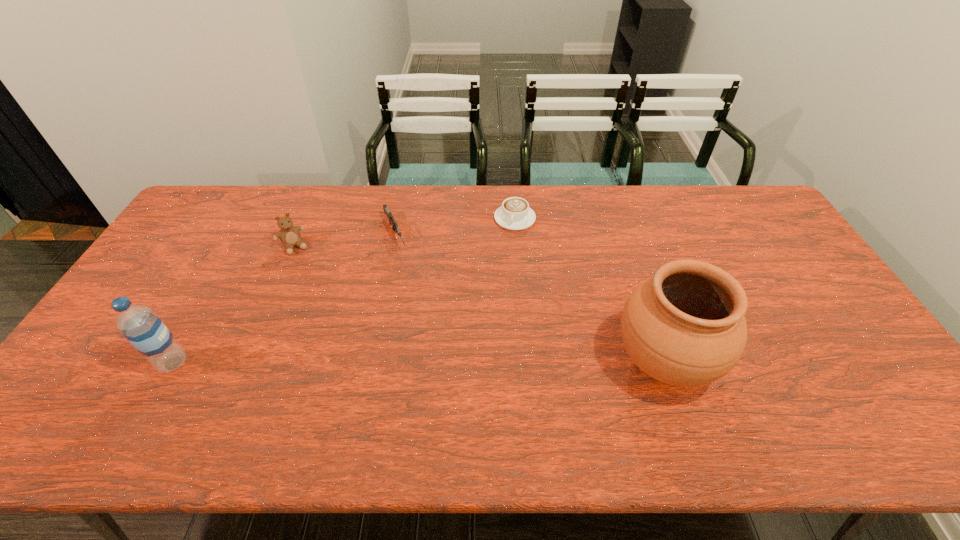
Where is `water bottle`? This screenshot has width=960, height=540. water bottle is located at coordinates (139, 324).

Where is `pottery`? pottery is located at coordinates [685, 326].

Where is `the fourth object from left to right`? The width and height of the screenshot is (960, 540). the fourth object from left to right is located at coordinates (514, 214).

Locate an element on the screen. Image resolution: width=960 pixels, height=540 pixels. teddy bear is located at coordinates click(289, 235).

This screenshot has height=540, width=960. What are the coordinates of `the third shortest object` in the screenshot? It's located at (289, 235).

Find the location of a particular element. gun is located at coordinates (388, 213).

Locate an element on the screen. The height and width of the screenshot is (540, 960). vacant space located 0.080m on the label of the water bottle is located at coordinates (220, 363).

Locate an element on the screen. free point located 0.230m on the back of the rightmost object is located at coordinates (630, 262).

Identify the location of free location located 0.270m with the handle on the right side of the fourth object from left to right. The image size is (960, 540). point(503,291).

Where is `vacant region located with the handle on the right side of the fourth object from left to right`? The image size is (960, 540). vacant region located with the handle on the right side of the fourth object from left to right is located at coordinates (507, 269).